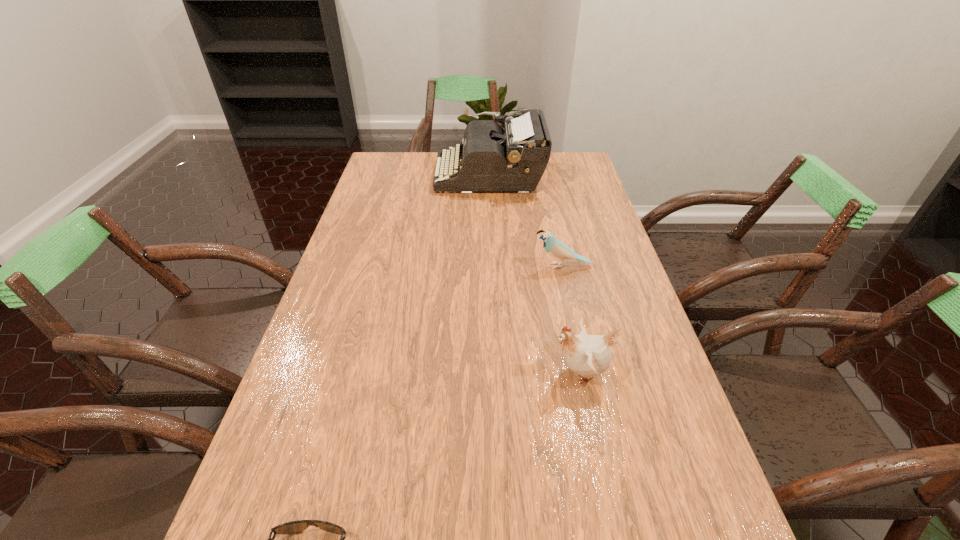
Find the location of a particular element. The width and height of the screenshot is (960, 540). vacant space that's between the second nearest object and the second farthest object is located at coordinates (571, 319).

Find the location of `vacant area that lies between the third farthest object and the typewriter`. vacant area that lies between the third farthest object and the typewriter is located at coordinates (535, 274).

Find the location of a particular element. empty space between the second nearest object and the third tallest object is located at coordinates (571, 319).

At what (x,y) coordinates should I click in order to perform the action: click on empty location between the taller bird and the farthest object. Please return your answer as a coordinate pair (x, y). The height and width of the screenshot is (540, 960). Looking at the image, I should click on (535, 274).

Where is `free point between the tallest object and the nearer bird`? free point between the tallest object and the nearer bird is located at coordinates (535, 274).

Locate which object ranks second in proximity to the second farthest object. Please provide its 2D coordinates. Your answer should be formatted as a tuple, i.e. [(x, y)], where the tuple contains the x and y coordinates of a point satisfying the conditions above.

[(493, 159)]

Where is `the third closest object to the tallest object`? This screenshot has width=960, height=540. the third closest object to the tallest object is located at coordinates (292, 527).